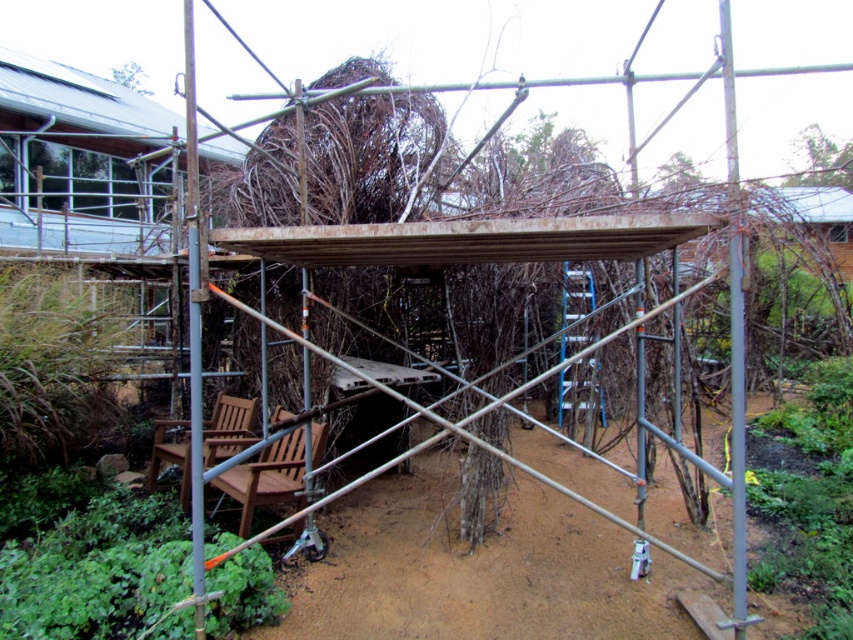
Question: Can you confirm if wooden chair at center is positioned to the right of wooden chair at lower left?

Choices:
 (A) yes
 (B) no

Answer: (A)

Question: Among these points, which one is farthest from the camera?

Choices:
 (A) (184, 483)
 (B) (276, 451)

Answer: (A)

Question: Does wooden chair at center lie in front of wooden chair at lower left?

Choices:
 (A) yes
 (B) no

Answer: (A)

Question: Observing the image, what is the correct spatial positioning of wooden chair at center in reference to wooden chair at lower left?

Choices:
 (A) below
 (B) above

Answer: (A)